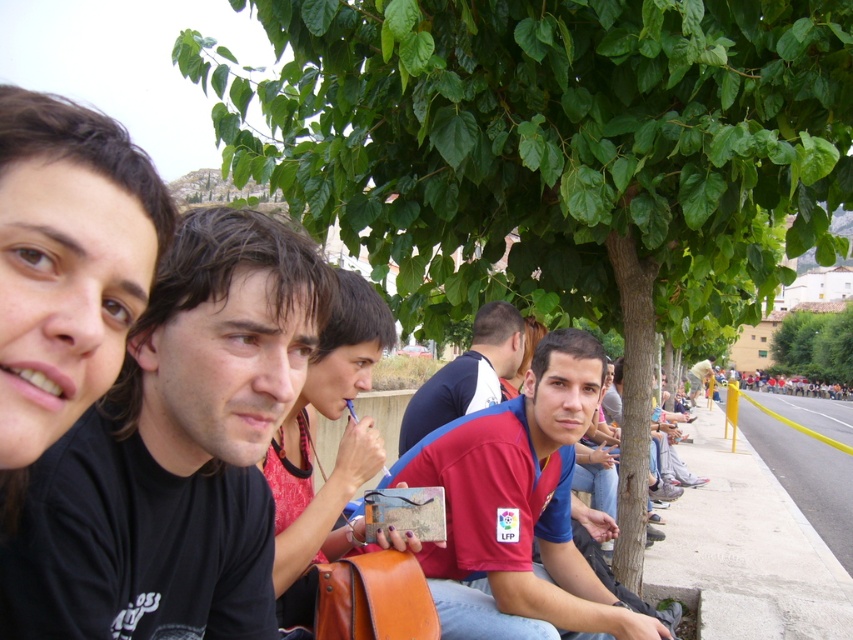
You are organizing a charity event and need to ensure all participants have the correct size clothing. You have two items available for a volunteer who is in the center of the image. The volunteer is wearing a red fabric shirt at center and a light brown leather jacket at center. Which clothing item should you provide a larger size for to ensure a better fit?

The light brown leather jacket at center requires a larger size because the red fabric shirt at center is smaller in size compared to it.